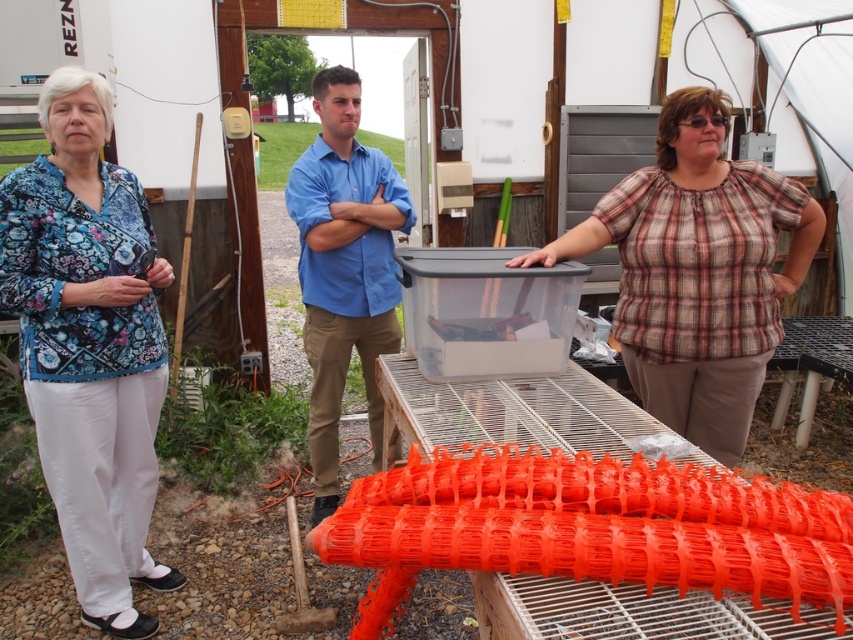
Is floral fabric blouse at left in front of plaid cotton shirt at center?

Yes, floral fabric blouse at left is closer to the viewer.

The height and width of the screenshot is (640, 853). Find the location of `floral fabric blouse at left`. floral fabric blouse at left is located at coordinates (90, 346).

Can you confirm if plaid cotton shirt at center is smaller than blue cotton shirt at center?

Correct, plaid cotton shirt at center occupies less space than blue cotton shirt at center.

In the scene shown: Is plaid cotton shirt at center to the left of blue cotton shirt at center from the viewer's perspective?

No, plaid cotton shirt at center is not to the left of blue cotton shirt at center.

You are a GUI agent. You are given a task and a screenshot of the screen. Output one action in this format:
    pyautogui.click(x=<x>, y=<y>)
    Task: Click on the plaid cotton shirt at center
    The image size is (853, 640).
    Given the screenshot: What is the action you would take?
    pyautogui.click(x=697, y=272)

Locate an element on the screen. plaid cotton shirt at center is located at coordinates coord(697,272).

Measure the distance between floral fabric blouse at left and camera.

The distance of floral fabric blouse at left from camera is 2.04 meters.

Which is below, floral fabric blouse at left or blue cotton shirt at center?

floral fabric blouse at left

Is point (22, 269) farther from camera compared to point (339, 264)?

No, (22, 269) is in front of (339, 264).

Find the location of a particular element. The height and width of the screenshot is (640, 853). floral fabric blouse at left is located at coordinates (90, 346).